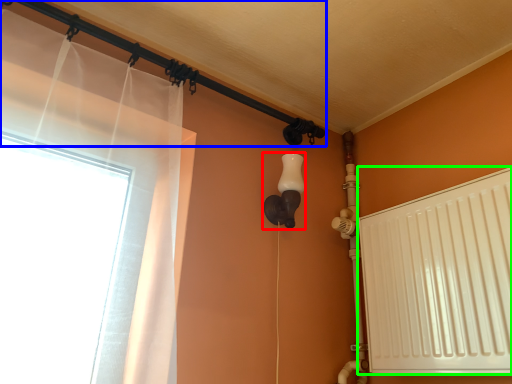
Question: Which object is the farthest from light fixture (highlighted by a red box)? Choose among these: pipe (highlighted by a blue box) or radiator (highlighted by a green box).

Choices:
 (A) pipe
 (B) radiator

Answer: (B)